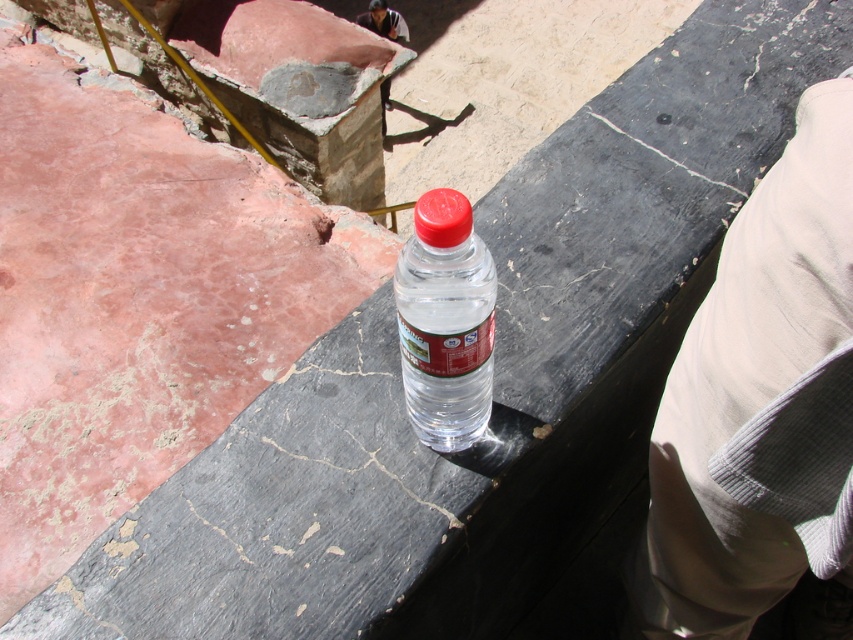
You are a GUI agent. You are given a task and a screenshot of the screen. Output one action in this format:
    pyautogui.click(x=<x>, y=<y>)
    Task: Click on the beige corduroy pants at lower right
    
    Given the screenshot: What is the action you would take?
    pyautogui.click(x=759, y=403)

Does beige corduroy pants at lower right come behind transparent plastic bottle at center?

No, beige corduroy pants at lower right is closer to the viewer.

Does point (842, 269) come behind point (486, 324)?

No, it is not.

At what (x,y) coordinates should I click in order to perform the action: click on beige corduroy pants at lower right. Please return your answer as a coordinate pair (x, y). The height and width of the screenshot is (640, 853). Looking at the image, I should click on (759, 403).